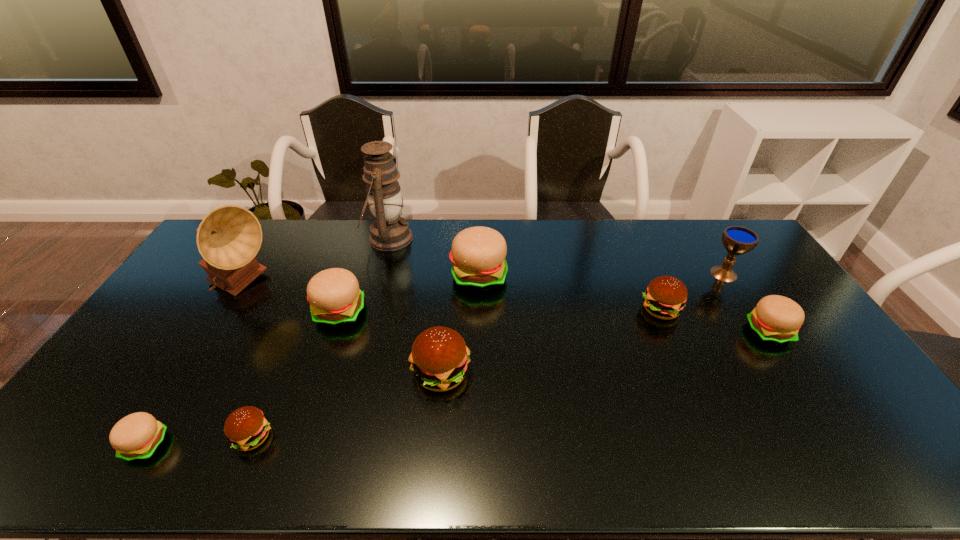
Locate which brown hamburger ranks in proximity to the rightmost beige hamburger. Please provide its 2D coordinates. Your answer should be formatted as a tuple, i.e. [(x, y)], where the tuple contains the x and y coordinates of a point satisfying the conditions above.

[(665, 297)]

Where is `vacant space that satisfies the following two spatial constraints: 1. on the horn of the second tallest object; 2. on the left side of the smallest brown hamburger`? Image resolution: width=960 pixels, height=540 pixels. vacant space that satisfies the following two spatial constraints: 1. on the horn of the second tallest object; 2. on the left side of the smallest brown hamburger is located at coordinates (151, 437).